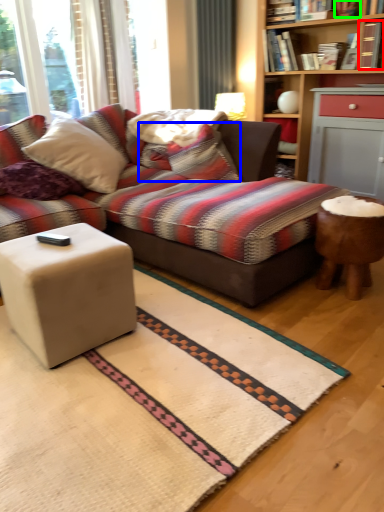
Question: Which object is the farthest from book (highlighted by a red box)? Choose among these: pillow (highlighted by a blue box) or book (highlighted by a green box).

Choices:
 (A) pillow
 (B) book

Answer: (A)